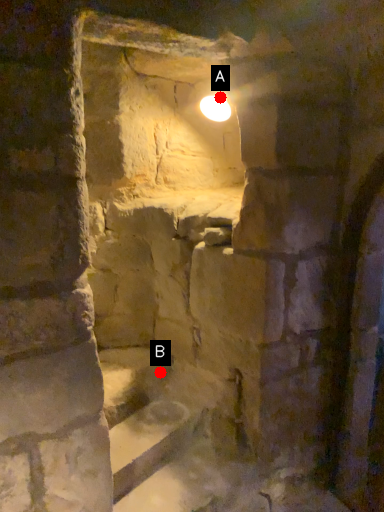
Question: Two points are circled on the image, labeled by A and B beside each circle. Which point is closer to the camera?

Choices:
 (A) A is closer
 (B) B is closer

Answer: (A)